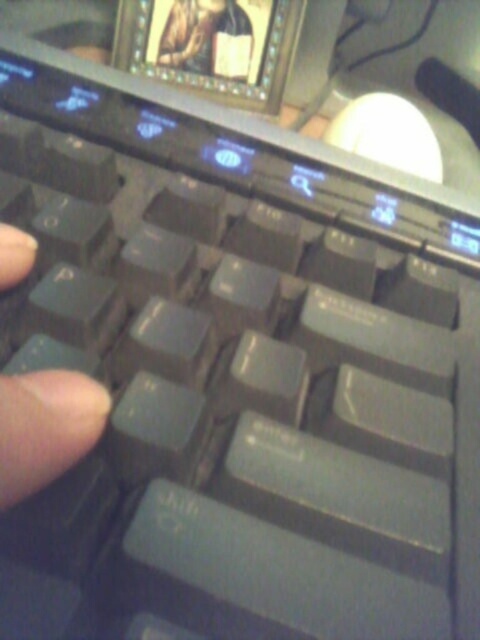
You are trying to navigate between two points on the laptop keyboard. The first point is at coordinate point(11,493) and the second is at point(217,65). Which point is closer to you when looking at the keyboard?

Point(11,493) is in front of point(217,65), so it is closer to you.